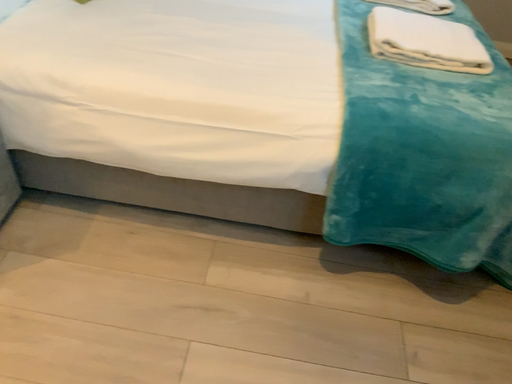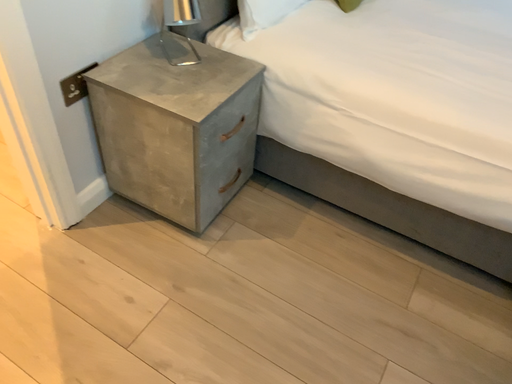
Question: How did the camera likely rotate when shooting the video?

Choices:
 (A) rotated right
 (B) rotated left

Answer: (B)